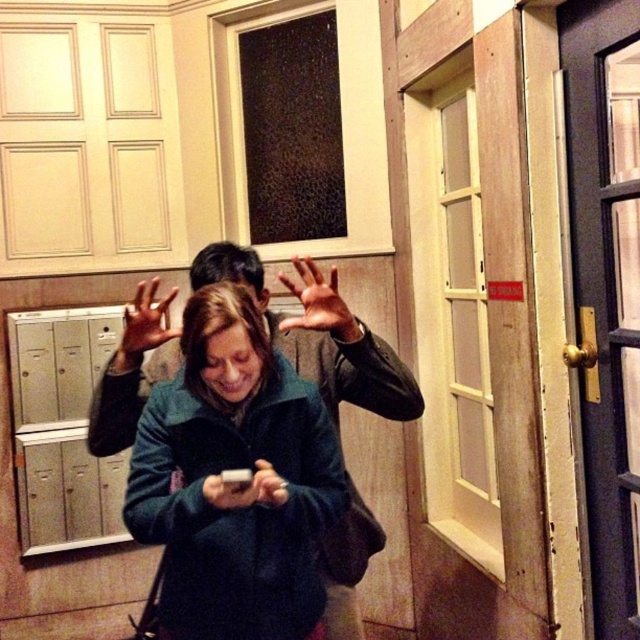
Question: Observing the image, what is the correct spatial positioning of matte green coat at center in reference to matte white phone at center?

Choices:
 (A) below
 (B) above

Answer: (A)

Question: Which object is positioned farthest from the matte white phone at center?

Choices:
 (A) brown leather hand at center
 (B) matte black phone at center

Answer: (A)

Question: Does matte green coat at center have a larger size compared to matte black hands at center?

Choices:
 (A) no
 (B) yes

Answer: (B)

Question: Which of the following is the farthest from the observer?

Choices:
 (A) matte green coat at center
 (B) matte white phone at center

Answer: (B)

Question: Does matte green coat at center have a lesser width compared to matte black hands at center?

Choices:
 (A) no
 (B) yes

Answer: (A)

Question: Which object appears closest to the camera in this image?

Choices:
 (A) matte green coat at center
 (B) matte white phone at center

Answer: (A)